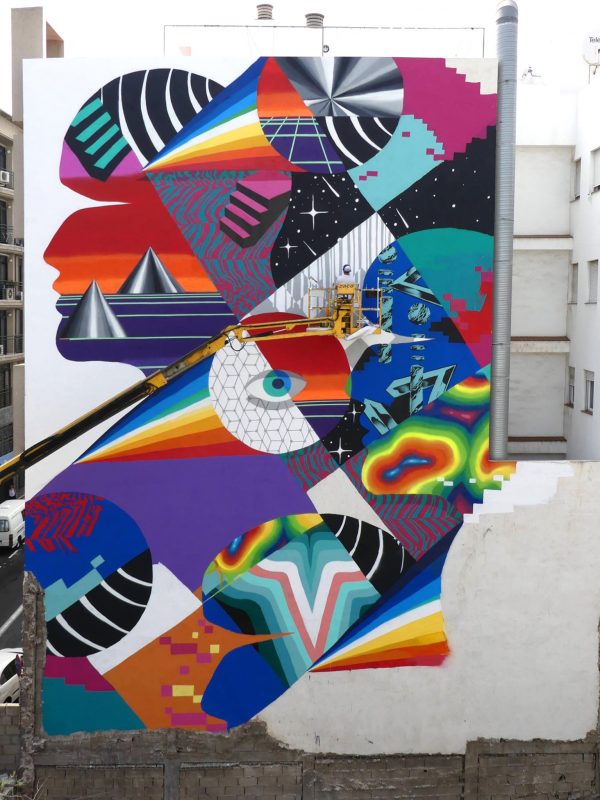
This screenshot has height=800, width=600. Find the location of `abstract art`. abstract art is located at coordinates click(294, 494).